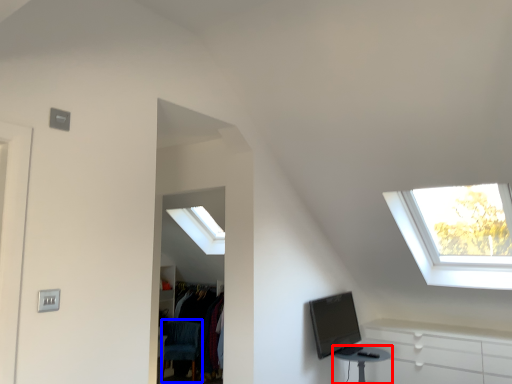
Question: Which of the following is the farthest to the observer, table (highlighted by a red box) or swivel chair (highlighted by a blue box)?

Choices:
 (A) table
 (B) swivel chair

Answer: (B)